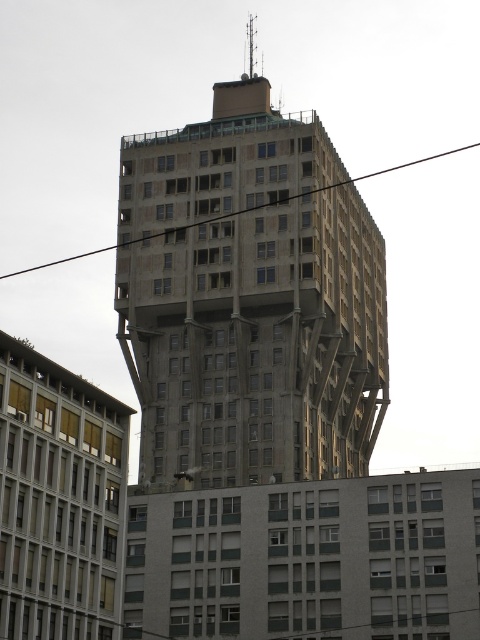
You are an architect analyzing the spatial relationship between the concrete building at center and the black wire at upper center in the image. Which object is placed higher in the scene?

The concrete building at center is positioned over the black wire at upper center, so the concrete building at center is higher in the scene.

You are standing at the point with coordinates (x=250, y=298) in the image. What object are you standing on?

You are standing on the concrete building at center located at point (x=250, y=298).

You are an architect analyzing the spatial relationship between the concrete building at center and the black wire at upper center in the image. Based on the scene, which object is closer to the viewer?

The concrete building at center is closer to the viewer than the black wire at upper center because it is in front of it.